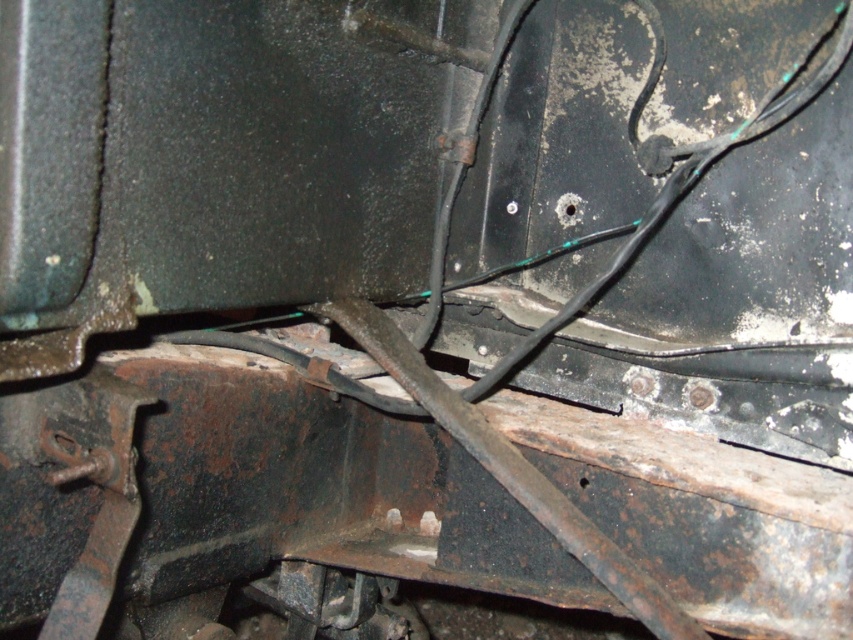
You are inspecting the underside of a vehicle and notice two bolts. The silver metallic bolt at center and the black metal bolt at center. Which bolt is bigger in size?

The silver metallic bolt at center is larger in size compared to the black metal bolt at center.

You are inspecting the underside of a vehicle and notice the silver metallic bolt at center. Based on the coordinates provided in the description, can you determine its exact position relative to the image frame?

The silver metallic bolt at center is located at point coordinates of 0.325 on the x axis and 0.600 on the y axis within the image frame.

You are a mechanic inspecting the underside of a vehicle. You notice a point at coordinates [511,208]. What object is located at that point?

The point at coordinates [511,208] indicates a silver metallic bolt at center.